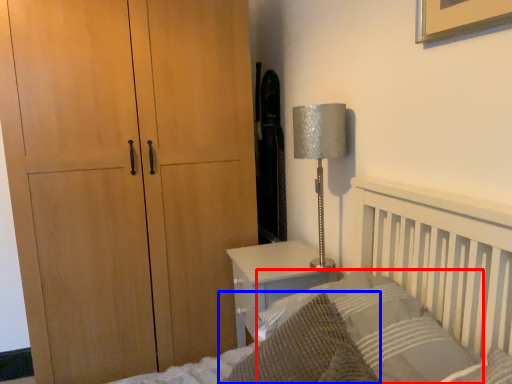
Question: Among these objects, which one is farthest to the camera, pillow (highlighted by a red box) or throw pillow (highlighted by a blue box)?

Choices:
 (A) pillow
 (B) throw pillow

Answer: (A)